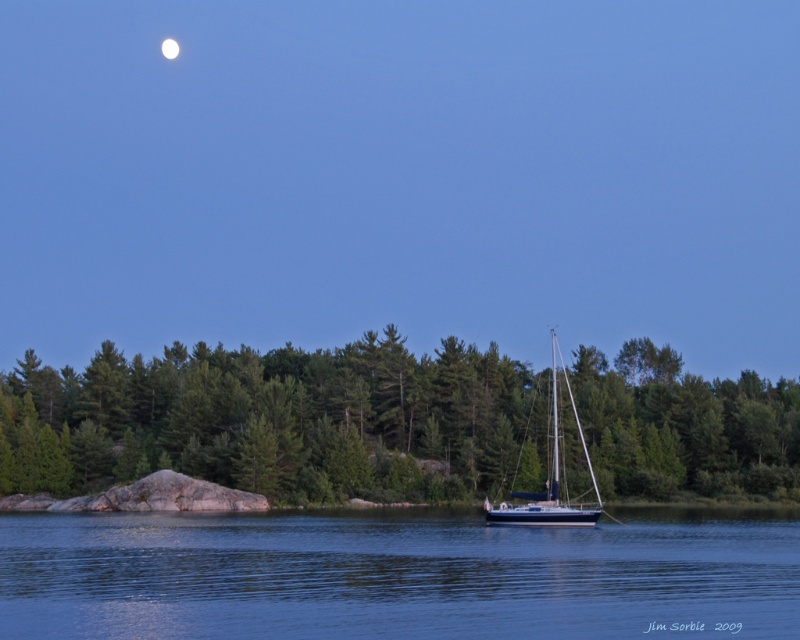
Based on the photo, you are standing at the lakeside and want to take a photo of the two points marked in the image. Which point, point (158,365) or point (566,497), will appear larger in your camera view?

Point (158,365) is further to the camera than point (566,497), so it will appear larger in the camera view.

You are standing on the lakeshore and want to take a photo of both the green matte tree at lower left and the blue glossy sailboat at center. Which object should you adjust your camera angle to focus on first to ensure both are in the frame?

The green matte tree at lower left is located above the blue glossy sailboat at center, so you should adjust your camera angle to focus on the green matte tree at lower left first to ensure both are in the frame.

Based on the photo, you are standing at the lakeside and want to take a photo of both point (106, 362) and point (532, 556). Which point will appear closer to the bottom of your camera viewfinder?

Point (532, 556) will appear closer to the bottom of the camera viewfinder because it is further away from the camera compared to point (106, 362), which is closer.